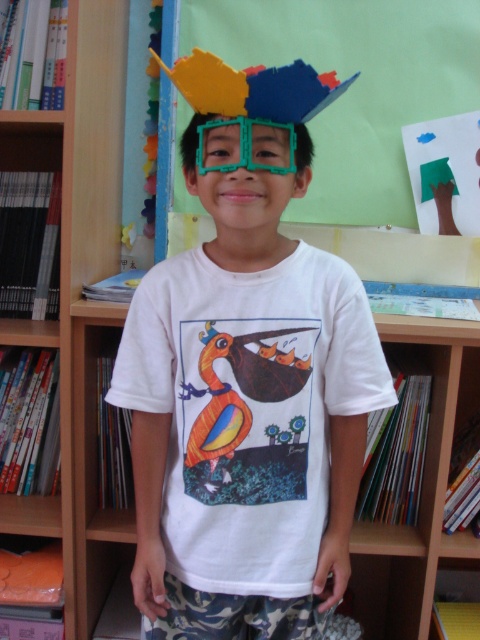
Question: Where is matte cardboard bulletin board at upper center located in relation to green plastic glasses at center in the image?

Choices:
 (A) below
 (B) above

Answer: (B)

Question: Can you confirm if matte cardboard bulletin board at upper center is smaller than green plastic glasses at center?

Choices:
 (A) no
 (B) yes

Answer: (A)

Question: Estimate the real-world distances between objects in this image. Which object is closer to the matte plastic mask at center?

Choices:
 (A) matte cardboard bulletin board at upper center
 (B) wooden bookshelf at left

Answer: (B)

Question: Is matte plastic mask at center above matte cardboard bulletin board at upper center?

Choices:
 (A) yes
 (B) no

Answer: (B)

Question: Which object is closer to the camera taking this photo?

Choices:
 (A) matte cardboard bulletin board at upper center
 (B) green plastic glasses at center
 (C) wooden bookshelf at left
 (D) matte plastic mask at center

Answer: (D)

Question: Which point is farther to the camera?

Choices:
 (A) green plastic glasses at center
 (B) wooden bookshelf at left
 (C) matte plastic mask at center
 (D) matte cardboard bulletin board at upper center

Answer: (D)